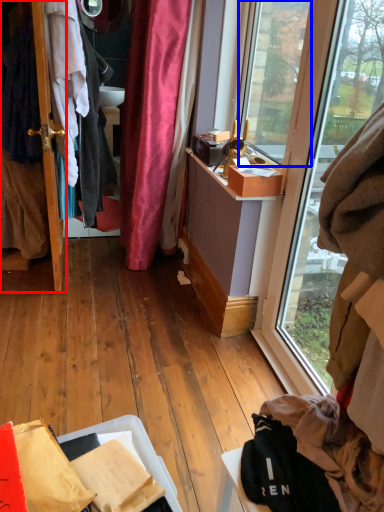
Question: Which object is closer to the camera taking this photo, door (highlighted by a red box) or window screen (highlighted by a blue box)?

Choices:
 (A) door
 (B) window screen

Answer: (B)